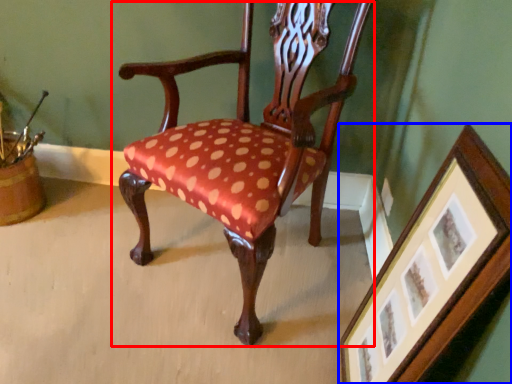
Question: Among these objects, which one is farthest to the camera, chair (highlighted by a red box) or picture frame (highlighted by a blue box)?

Choices:
 (A) chair
 (B) picture frame

Answer: (A)